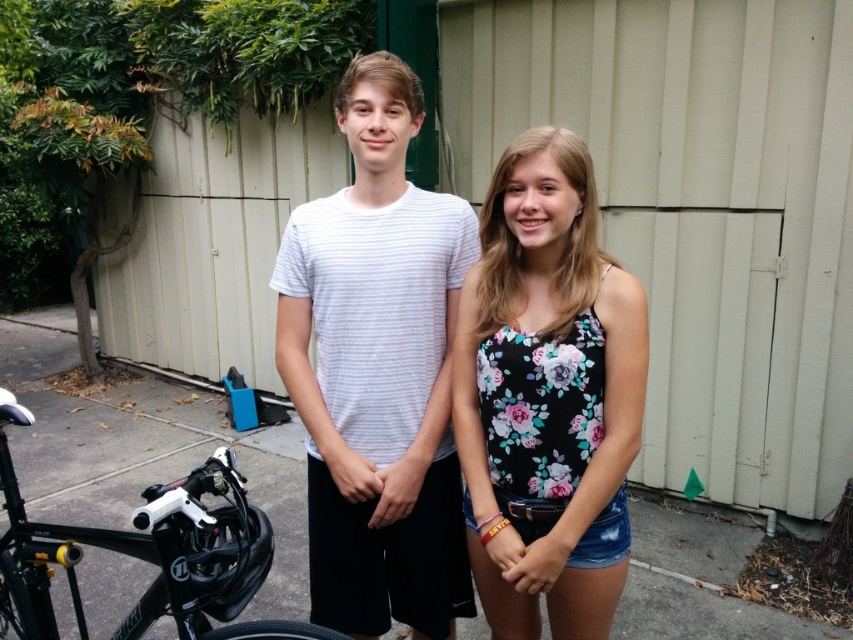
Question: Among these points, which one is farthest from the camera?

Choices:
 (A) (0, 624)
 (B) (405, 464)
 (C) (48, 412)
 (D) (503, 428)

Answer: (C)

Question: Where is floral print tank top at center located in relation to black matte bicycle at lower left in the image?

Choices:
 (A) below
 (B) above

Answer: (B)

Question: Can you confirm if floral print tank top at center is wider than black matte bicycle at lower left?

Choices:
 (A) no
 (B) yes

Answer: (A)

Question: Which object is positioned closest to the floral print tank top at center?

Choices:
 (A) gray concrete pavement at center
 (B) white striped t-shirt at center

Answer: (B)

Question: Which is nearer to the gray concrete pavement at center?

Choices:
 (A) white striped t-shirt at center
 (B) black matte bicycle at lower left
 (C) floral print tank top at center

Answer: (B)

Question: Is white striped t-shirt at center thinner than floral print tank top at center?

Choices:
 (A) no
 (B) yes

Answer: (A)